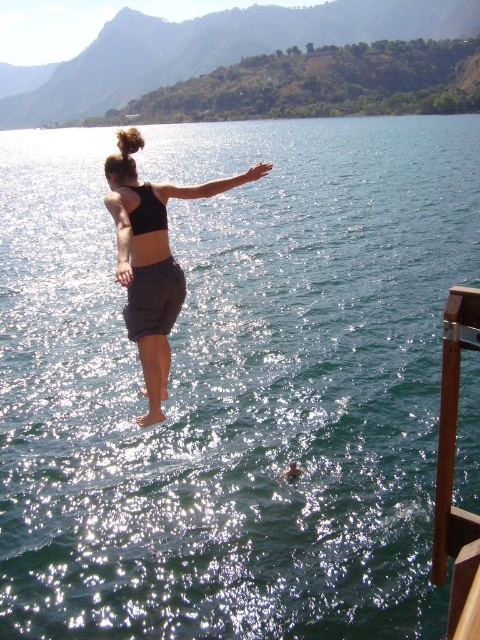
Can you confirm if black matte shorts at center is smaller than brown wood boat at right?

Incorrect, black matte shorts at center is not smaller in size than brown wood boat at right.

Does black matte shorts at center have a greater width compared to brown wood boat at right?

Yes.

Who is more distant from viewer, (120, 164) or (443, 429)?

Positioned behind is point (443, 429).

Image resolution: width=480 pixels, height=640 pixels. What are the coordinates of `black matte shorts at center` in the screenshot? It's located at (152, 259).

Which is more to the right, black matte shorts at center or black matte bikini top at center?

Positioned to the right is black matte bikini top at center.

Can you confirm if black matte shorts at center is thinner than black matte bikini top at center?

In fact, black matte shorts at center might be wider than black matte bikini top at center.

Find the location of a particular element. The height and width of the screenshot is (640, 480). black matte shorts at center is located at coordinates (152, 259).

The height and width of the screenshot is (640, 480). What are the coordinates of `black matte shorts at center` in the screenshot? It's located at (152, 259).

Based on the photo, who is more forward, (444,413) or (157,198)?

Point (157,198) is in front.

What do you see at coordinates (453, 474) in the screenshot? I see `brown wood boat at right` at bounding box center [453, 474].

Does point (441, 528) lie behind point (153, 228)?

Yes, point (441, 528) is behind point (153, 228).

What are the coordinates of `brown wood boat at right` in the screenshot? It's located at (453, 474).